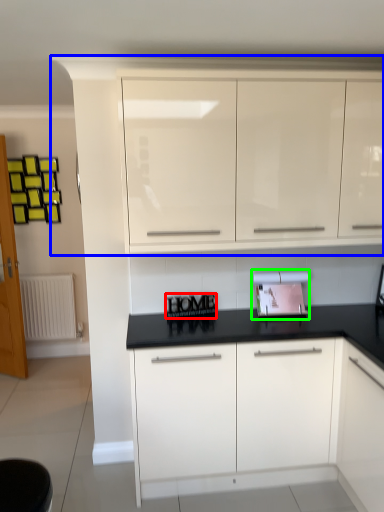
Question: Which is farther away from writing (highlighted by a red box)? cabinetry (highlighted by a blue box) or appliance (highlighted by a green box)?

Choices:
 (A) cabinetry
 (B) appliance

Answer: (A)